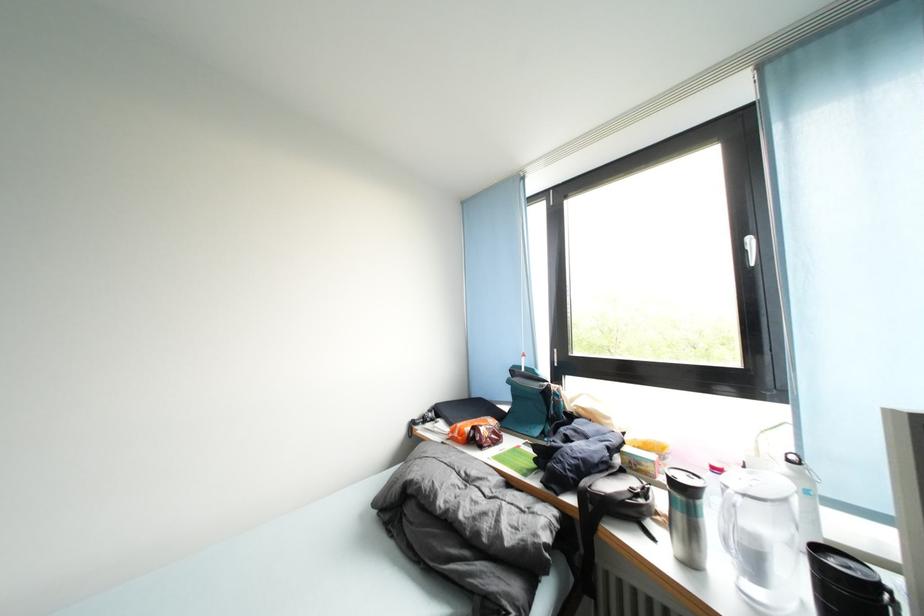
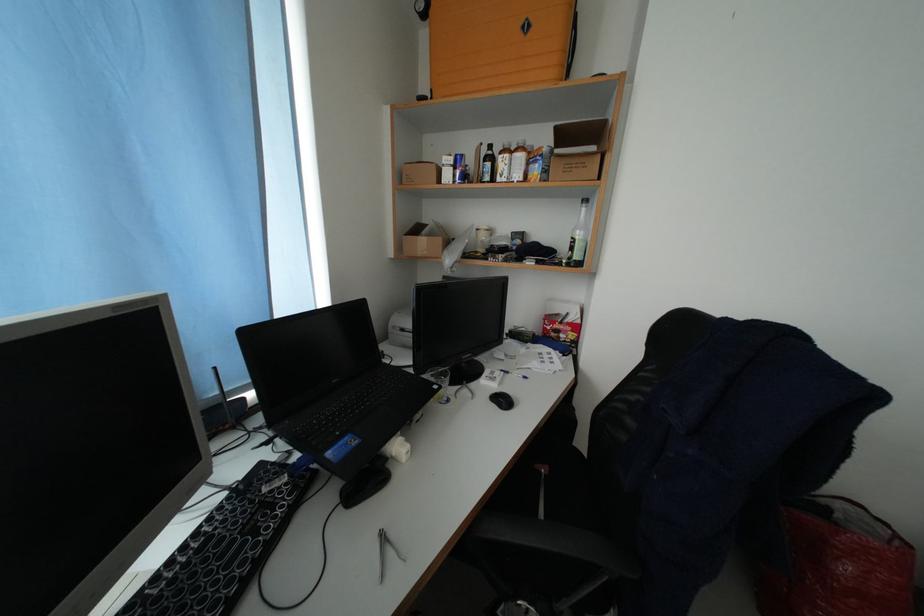
Question: How did the camera likely rotate?

Choices:
 (A) Left
 (B) Right
 (C) Up
 (D) Down

Answer: (B)